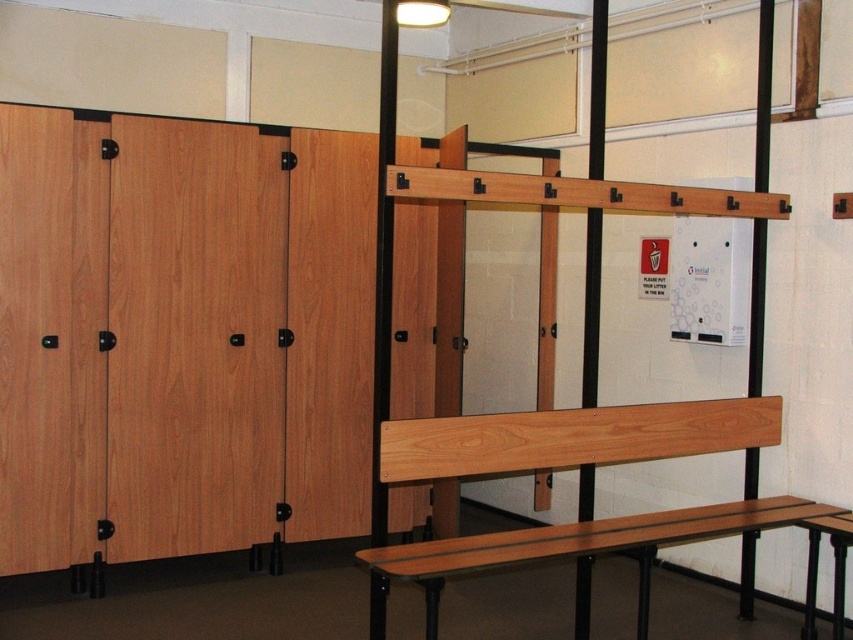
Question: Is natural wood bench at center below wooden bench at center?

Choices:
 (A) no
 (B) yes

Answer: (A)

Question: Which point is closer to the camera?

Choices:
 (A) (811, 563)
 (B) (383, 552)

Answer: (B)

Question: Is natural wood bench at center to the left of wooden bench at center from the viewer's perspective?

Choices:
 (A) yes
 (B) no

Answer: (A)

Question: Which point is farther to the camera?

Choices:
 (A) wooden bench at center
 (B) natural wood bench at center

Answer: (A)

Question: Observing the image, what is the correct spatial positioning of natural wood bench at center in reference to wooden bench at center?

Choices:
 (A) right
 (B) left

Answer: (B)